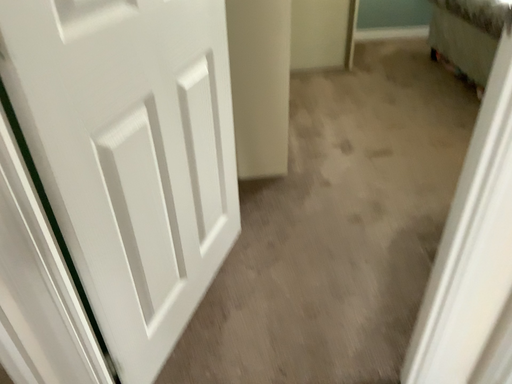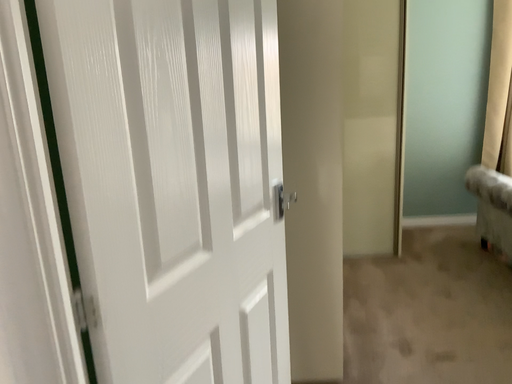
Question: Which way did the camera rotate in the video?

Choices:
 (A) rotated downward
 (B) rotated upward

Answer: (B)